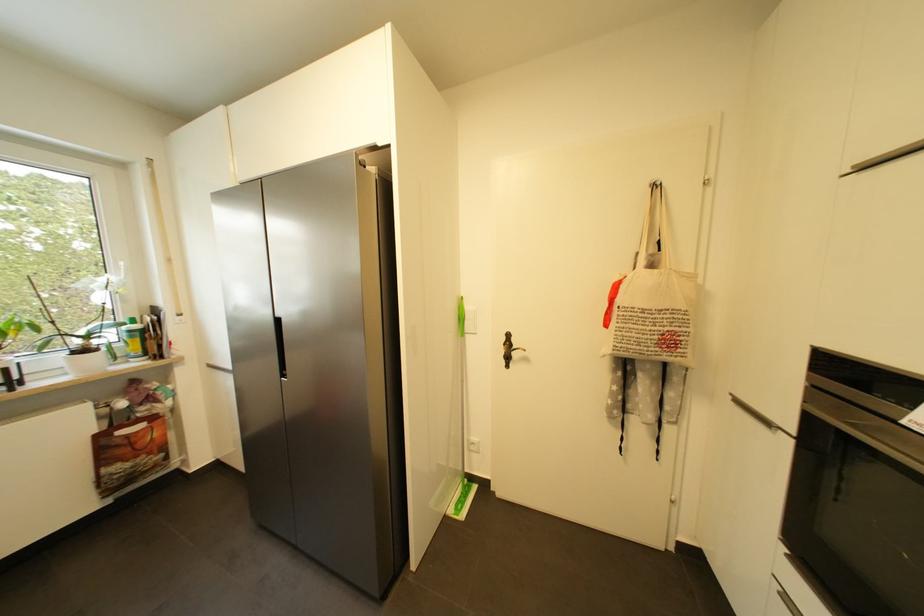
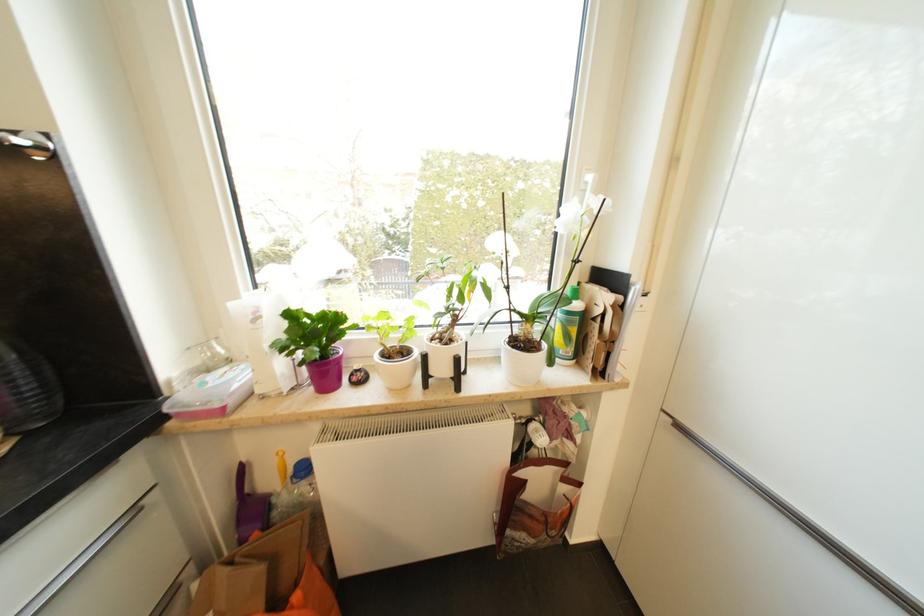
Locate, in the second image, the point that corresponds to pixel 215 368 in the first image.

(685, 429)